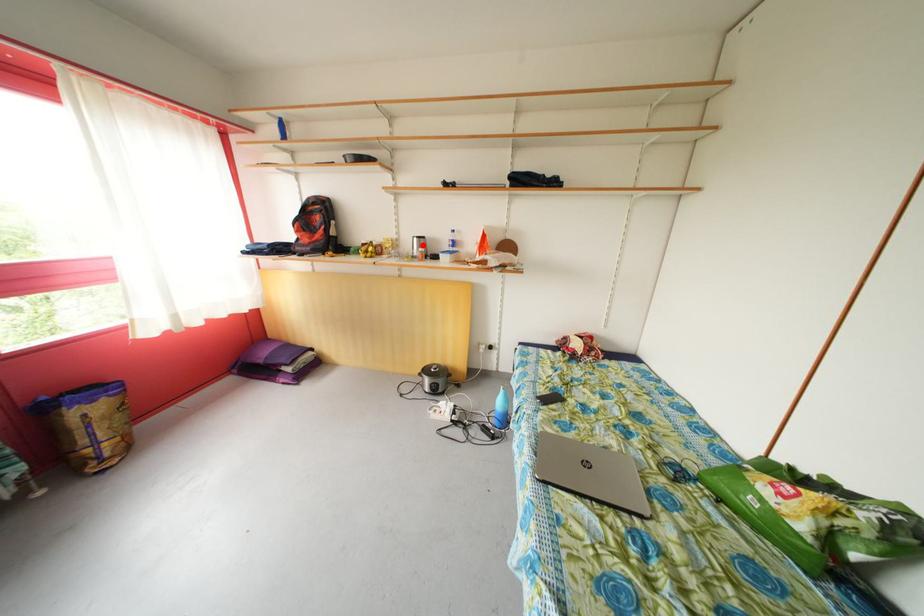
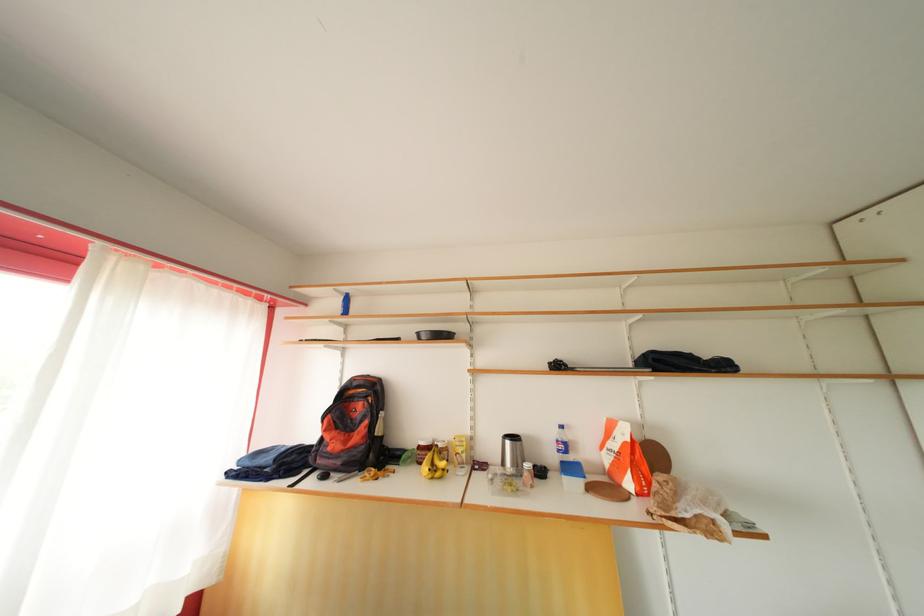
Question: I am providing you with two images of the same scene from different viewpoints. A red point is shown in image1. For the corresponding object point in image2, is it positioned nearer or farther from the camera?

Choices:
 (A) Nearer
 (B) Farther

Answer: (B)